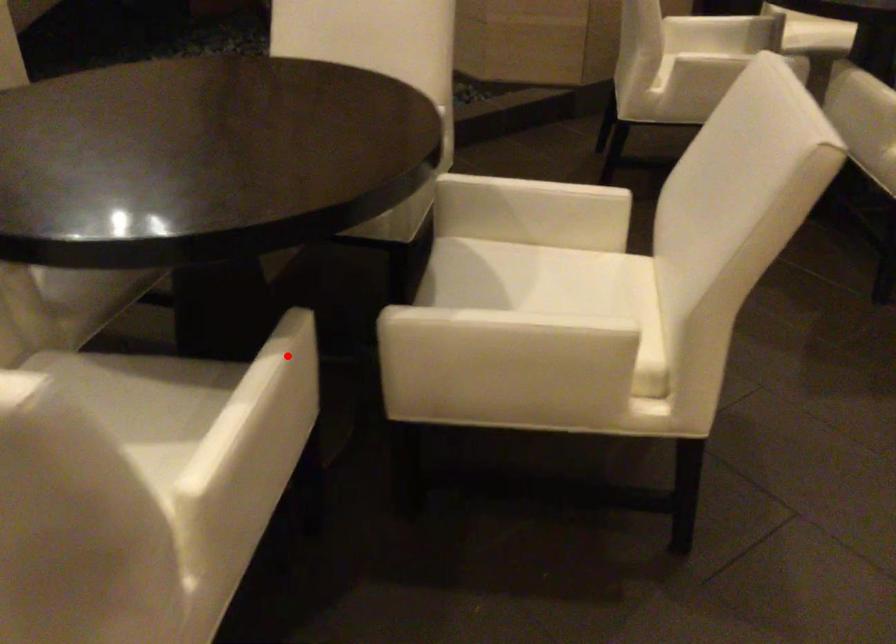
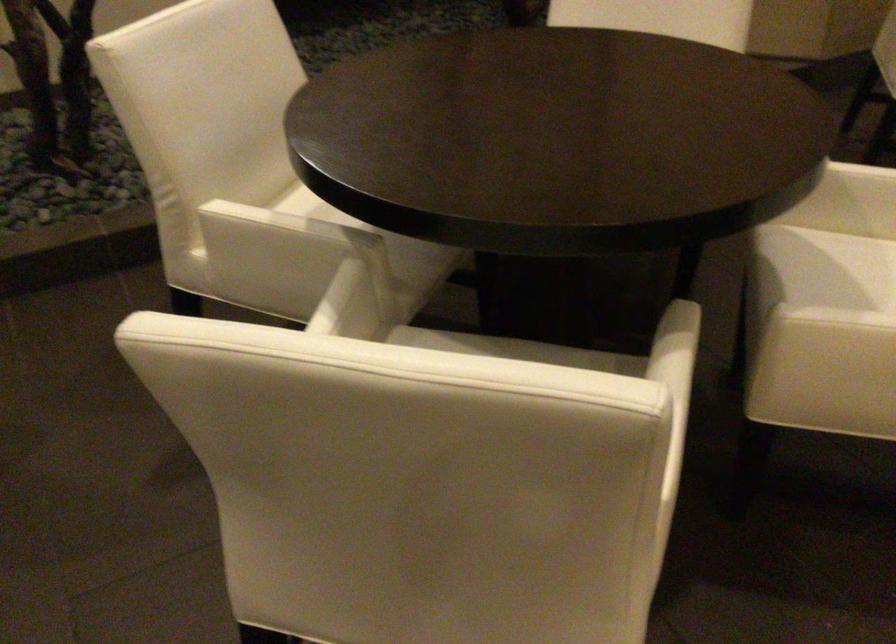
Locate, in the second image, the point that corresponds to the highlighted location in the first image.

(688, 353)